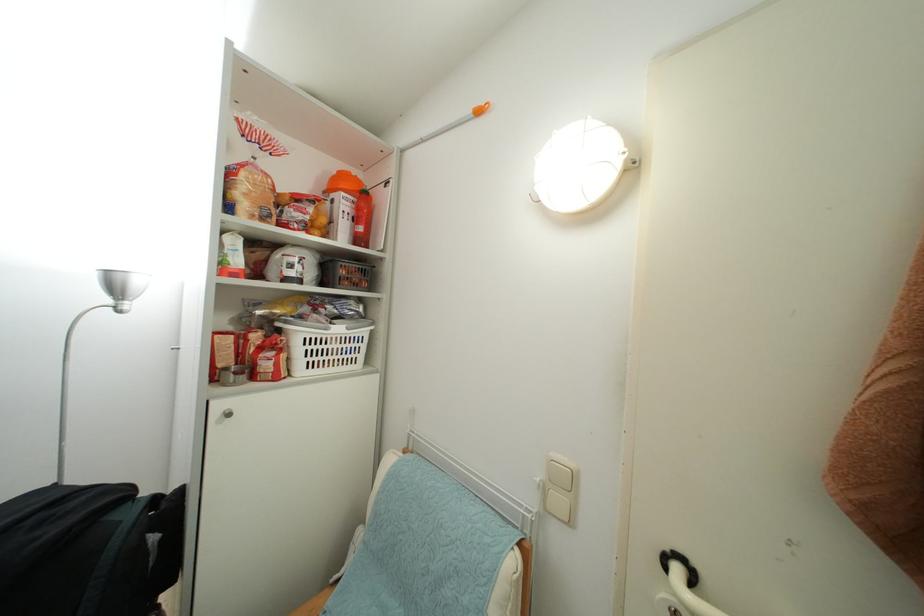
Identify the location of white light switch. (561, 488).